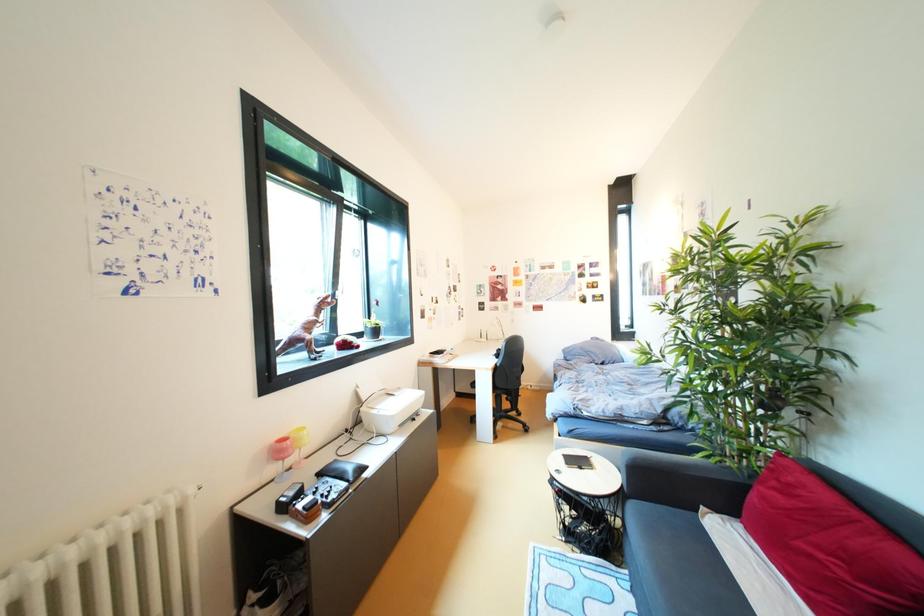
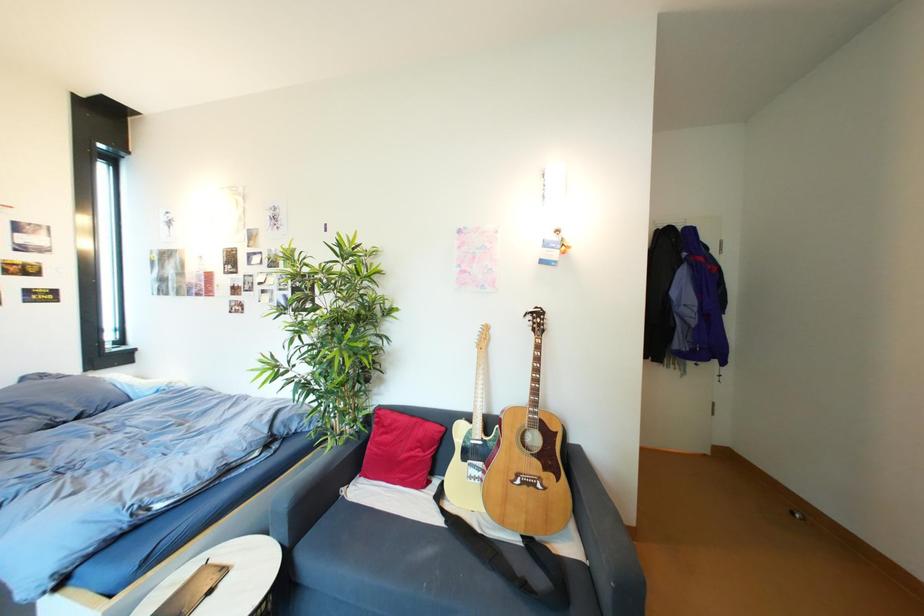
Question: The camera is either moving clockwise (left) or counter-clockwise (right) around the object. The first image is from the beginning of the video and the second image is from the end. Is the camera moving left or right when shooting the video?

Choices:
 (A) Left
 (B) Right

Answer: (A)